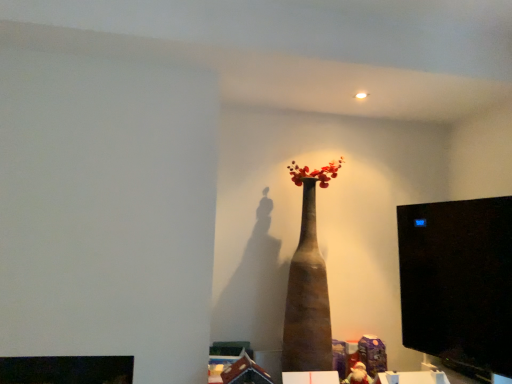
Question: Can you confirm if brown matte vase at center is positioned to the right of black glossy monitor at right?

Choices:
 (A) no
 (B) yes

Answer: (A)

Question: Is black glossy monitor at right inside brown matte vase at center?

Choices:
 (A) yes
 (B) no

Answer: (B)

Question: Considering the relative sizes of brown matte vase at center and black glossy monitor at right in the image provided, is brown matte vase at center bigger than black glossy monitor at right?

Choices:
 (A) yes
 (B) no

Answer: (A)

Question: Considering the relative sizes of brown matte vase at center and black glossy monitor at right in the image provided, is brown matte vase at center taller than black glossy monitor at right?

Choices:
 (A) yes
 (B) no

Answer: (A)

Question: Is brown matte vase at center not within black glossy monitor at right?

Choices:
 (A) yes
 (B) no

Answer: (A)

Question: From a real-world perspective, is brown matte vase at center on black glossy monitor at right?

Choices:
 (A) no
 (B) yes

Answer: (B)

Question: Is black glossy monitor at right bigger than brown matte vase at center?

Choices:
 (A) yes
 (B) no

Answer: (B)

Question: From a real-world perspective, is black glossy monitor at right physically above brown matte vase at center?

Choices:
 (A) yes
 (B) no

Answer: (B)

Question: Does black glossy monitor at right lie behind brown matte vase at center?

Choices:
 (A) yes
 (B) no

Answer: (B)

Question: Does black glossy monitor at right have a lesser width compared to brown matte vase at center?

Choices:
 (A) yes
 (B) no

Answer: (A)

Question: From a real-world perspective, does black glossy monitor at right sit lower than brown matte vase at center?

Choices:
 (A) yes
 (B) no

Answer: (A)

Question: Is black glossy monitor at right oriented away from brown matte vase at center?

Choices:
 (A) yes
 (B) no

Answer: (B)

Question: Do you think black glossy monitor at right is within brown matte vase at center, or outside of it?

Choices:
 (A) inside
 (B) outside

Answer: (B)